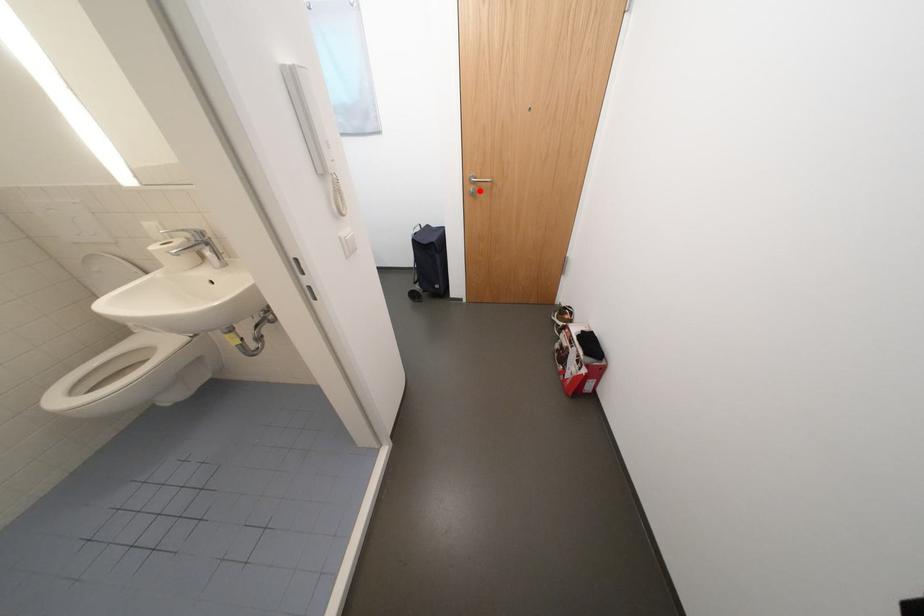
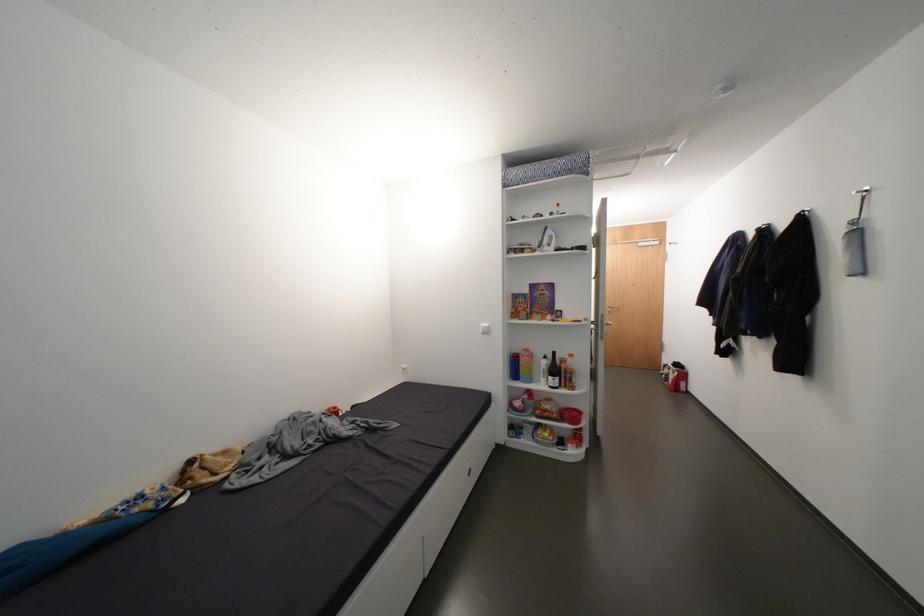
The point at the highlighted location is marked in the first image. Where is the corresponding point in the second image?

(616, 310)